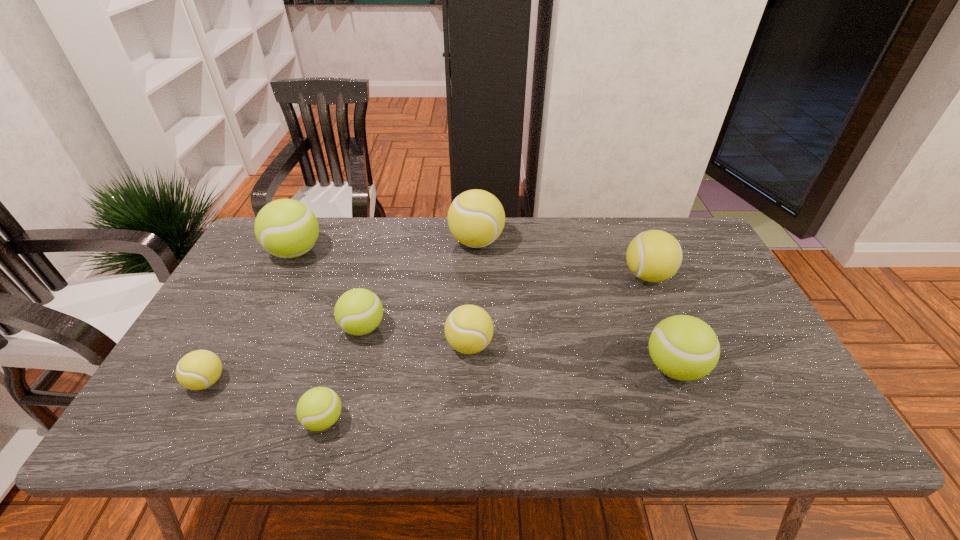
The height and width of the screenshot is (540, 960). I want to click on free space that satisfies the following two spatial constraints: 1. on the back side of the nearest green tennis ball; 2. on the left side of the biggest yellow tennis ball, so click(x=375, y=241).